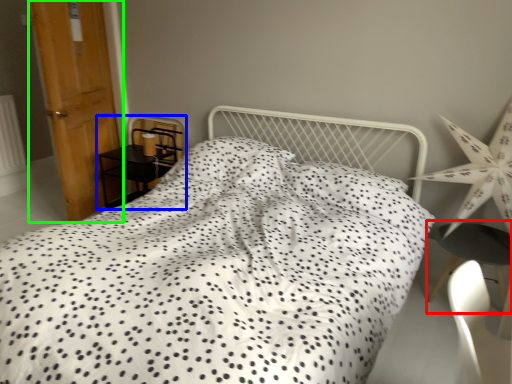
Question: Which is farther away from table (highlighted by a red box)? furniture (highlighted by a blue box) or door (highlighted by a green box)?

Choices:
 (A) furniture
 (B) door

Answer: (B)